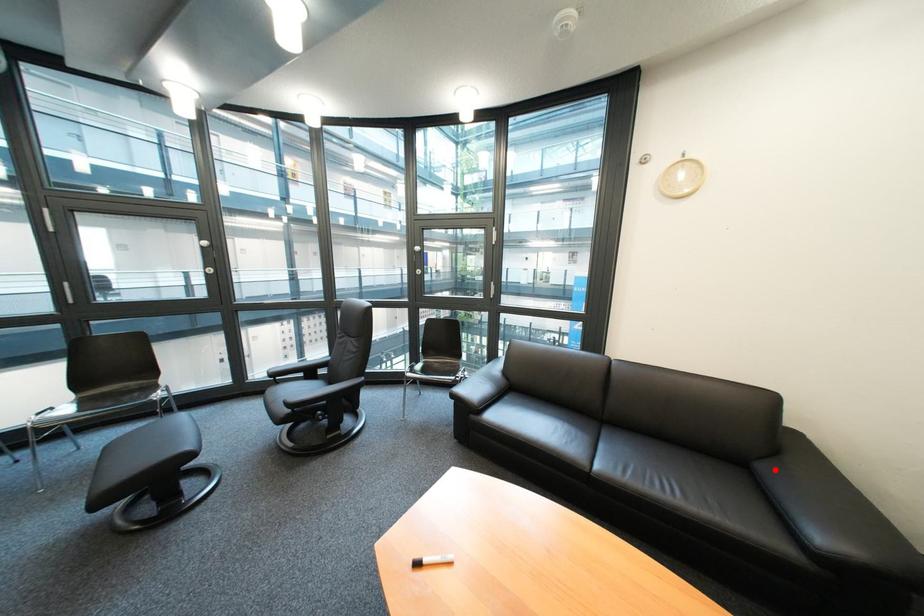
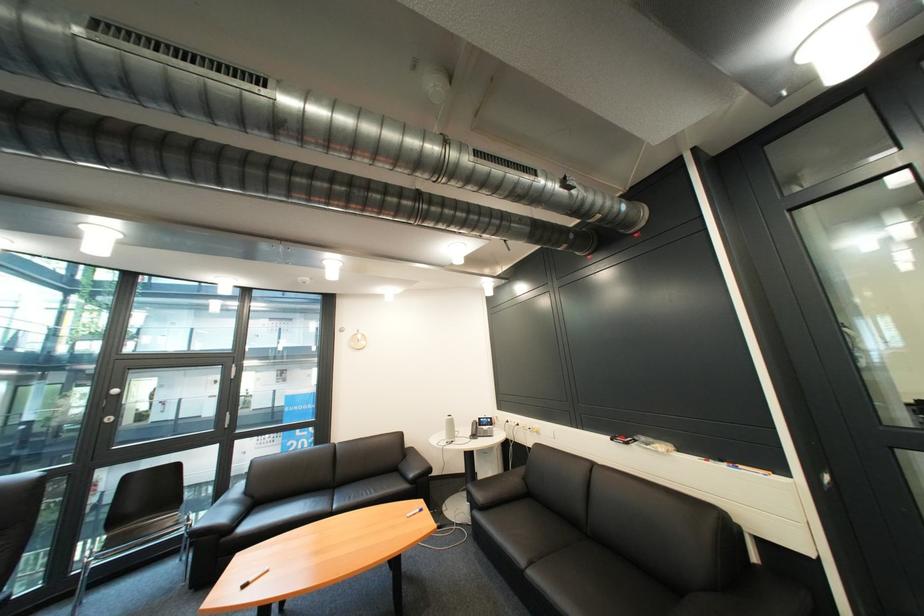
Question: I am providing you with two images of the same scene from different viewpoints. Image1 has a red point marked. In image2, the corresponding 3D location appears at what relative position? Reply with the corresponding letter.

Choices:
 (A) Closer
 (B) Farther

Answer: (B)